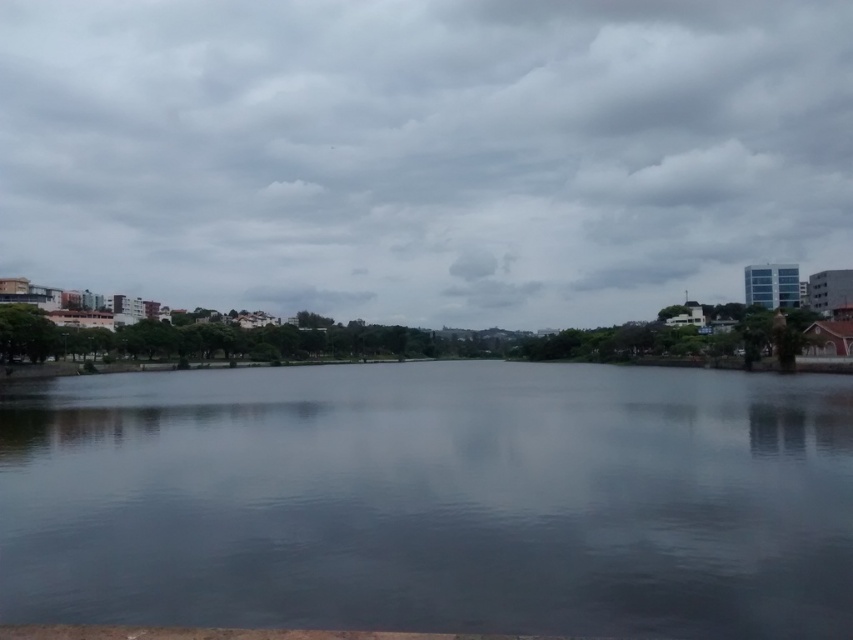
Question: Is cloudy sky at upper center below smooth water at center?

Choices:
 (A) no
 (B) yes

Answer: (A)

Question: Is cloudy sky at upper center to the left of smooth water at center from the viewer's perspective?

Choices:
 (A) yes
 (B) no

Answer: (A)

Question: Which object is closer to the camera taking this photo?

Choices:
 (A) smooth water at center
 (B) cloudy sky at upper center

Answer: (A)

Question: Which object appears farthest from the camera in this image?

Choices:
 (A) smooth water at center
 (B) cloudy sky at upper center

Answer: (B)

Question: Observing the image, what is the correct spatial positioning of cloudy sky at upper center in reference to smooth water at center?

Choices:
 (A) below
 (B) above

Answer: (B)